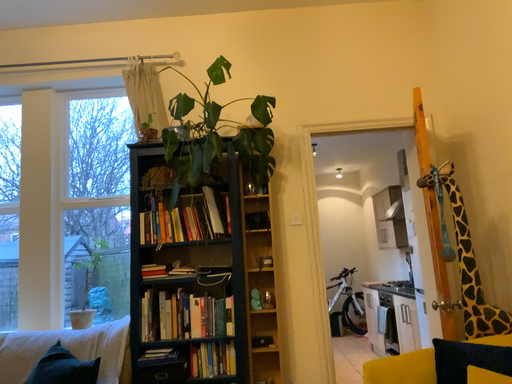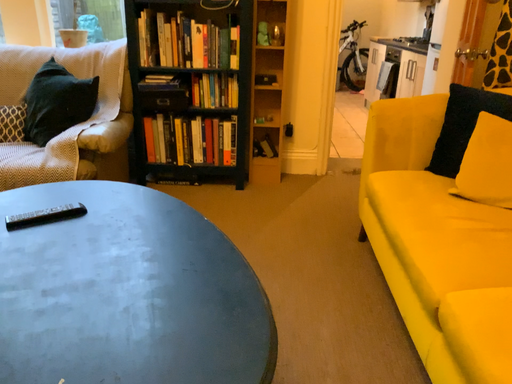
Question: How did the camera likely rotate when shooting the video?

Choices:
 (A) rotated downward
 (B) rotated upward

Answer: (A)